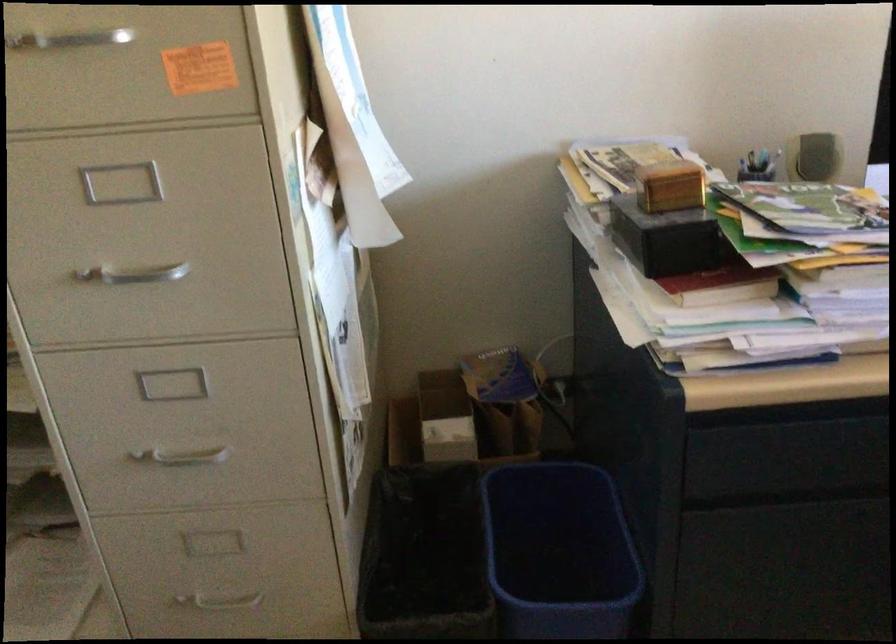
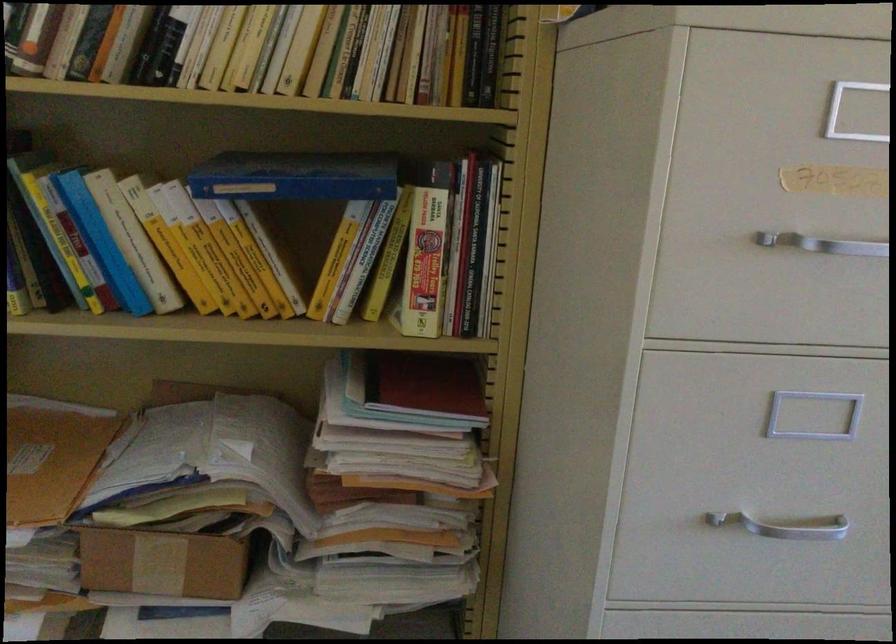
In the second image, find the point that corresponds to [159,274] in the first image.

(784, 526)